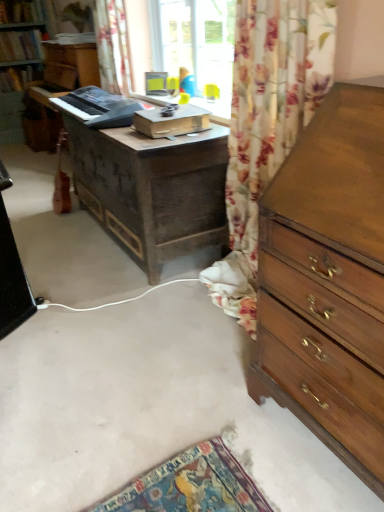
Question: From the image's perspective, is black plastic keyboard at center on dark brown wooden desk at center?

Choices:
 (A) yes
 (B) no

Answer: (A)

Question: Considering the relative sizes of black plastic keyboard at center and dark brown wooden desk at center in the image provided, is black plastic keyboard at center shorter than dark brown wooden desk at center?

Choices:
 (A) no
 (B) yes

Answer: (B)

Question: Is black plastic keyboard at center wider than dark brown wooden desk at center?

Choices:
 (A) yes
 (B) no

Answer: (B)

Question: Is there a large distance between black plastic keyboard at center and dark brown wooden desk at center?

Choices:
 (A) yes
 (B) no

Answer: (B)

Question: Is the position of black plastic keyboard at center less distant than that of dark brown wooden desk at center?

Choices:
 (A) yes
 (B) no

Answer: (B)

Question: Based on their sizes in the image, would you say wooden chest of drawers at right is bigger or smaller than dark brown wooden desk at center?

Choices:
 (A) big
 (B) small

Answer: (B)

Question: Considering their positions, is wooden chest of drawers at right located in front of or behind dark brown wooden desk at center?

Choices:
 (A) front
 (B) behind

Answer: (A)

Question: Is wooden chest of drawers at right spatially inside dark brown wooden desk at center, or outside of it?

Choices:
 (A) inside
 (B) outside

Answer: (B)

Question: From a real-world perspective, is wooden chest of drawers at right above or below dark brown wooden desk at center?

Choices:
 (A) above
 (B) below

Answer: (A)

Question: In the image, is floral fabric curtain at upper center on the left side or the right side of wooden chest of drawers at right?

Choices:
 (A) left
 (B) right

Answer: (A)

Question: Looking at the image, does floral fabric curtain at upper center seem bigger or smaller compared to wooden chest of drawers at right?

Choices:
 (A) small
 (B) big

Answer: (A)

Question: Is floral fabric curtain at upper center spatially inside wooden chest of drawers at right, or outside of it?

Choices:
 (A) inside
 (B) outside

Answer: (B)

Question: From a real-world perspective, is floral fabric curtain at upper center above or below wooden chest of drawers at right?

Choices:
 (A) above
 (B) below

Answer: (A)

Question: Is dark brown wooden desk at center inside or outside of black plastic keyboard at center?

Choices:
 (A) outside
 (B) inside

Answer: (A)

Question: Is dark brown wooden desk at center bigger or smaller than black plastic keyboard at center?

Choices:
 (A) big
 (B) small

Answer: (A)